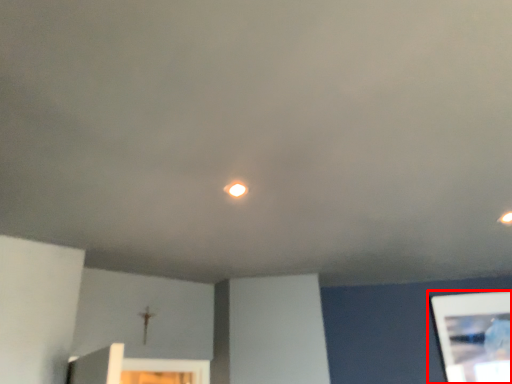
Question: From the image's perspective, what is the correct spatial relationship of picture frame (annotated by the red box) in relation to light?

Choices:
 (A) below
 (B) above

Answer: (A)